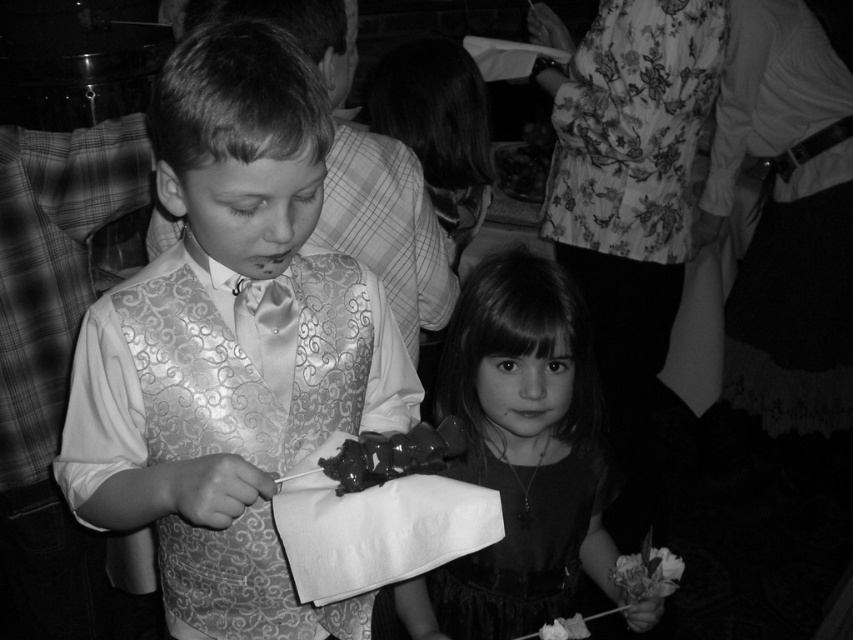
Does satin vest at left have a greater height compared to smooth black dress at center?

Yes, satin vest at left is taller than smooth black dress at center.

Is satin vest at left further to the viewer compared to smooth black dress at center?

No, satin vest at left is closer to the viewer.

The width and height of the screenshot is (853, 640). What do you see at coordinates (231, 346) in the screenshot?
I see `satin vest at left` at bounding box center [231, 346].

The image size is (853, 640). I want to click on satin vest at left, so click(231, 346).

Who is positioned more to the right, satin vest at left or shiny dark chocolate at lower center?

From the viewer's perspective, shiny dark chocolate at lower center appears more on the right side.

Does satin vest at left appear under shiny dark chocolate at lower center?

Indeed, satin vest at left is positioned under shiny dark chocolate at lower center.

Is point (251, 596) positioned behind point (349, 477)?

That is True.

The width and height of the screenshot is (853, 640). Identify the location of satin vest at left. (231, 346).

Can you confirm if satin vest at left is taller than silky satin vest at center?

Yes.

Which of these two, satin vest at left or silky satin vest at center, stands taller?

satin vest at left

What do you see at coordinates (231, 346) in the screenshot?
I see `satin vest at left` at bounding box center [231, 346].

In order to click on satin vest at left in this screenshot , I will do `click(231, 346)`.